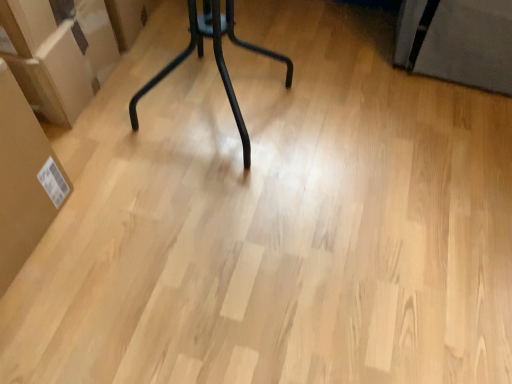
Locate an element on the screen. empty space that is to the right of brown cardboard box at left, placed as the first cardboard box when sorted from front to back is located at coordinates (108, 243).